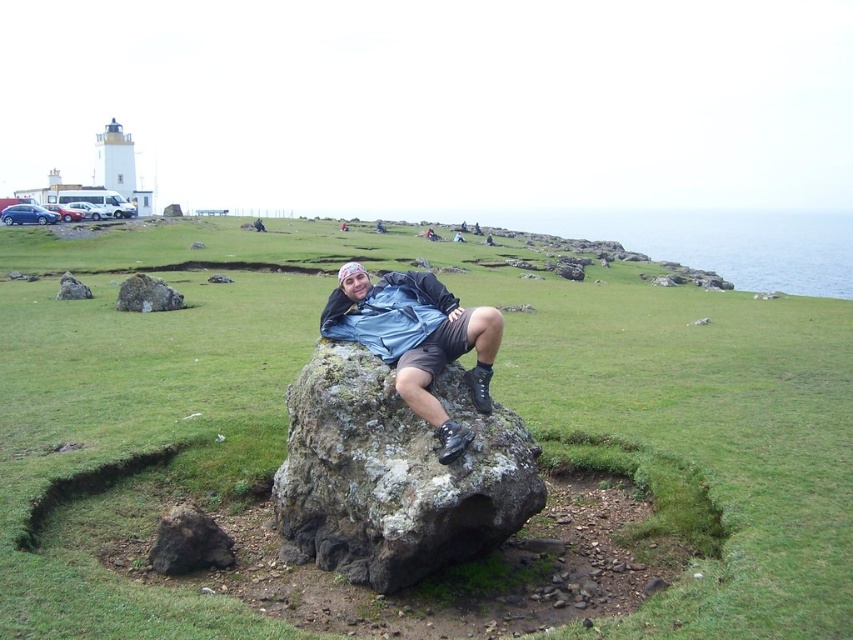
You are standing in the coastal scene and want to walk towards the green grassy at center and the rusty rock at center. Which object will you reach first?

You will reach the green grassy at center first because it is closer to you than the rusty rock at center.

You are a photographer trying to capture the person in the matte blue shirt at center. The green grassy at center is obstructing the view. Can you determine if the grass is tall enough to block the person from being seen?

The green grassy at center is much taller than the matte blue shirt at center, so yes, the grass is tall enough to block the person from being seen.